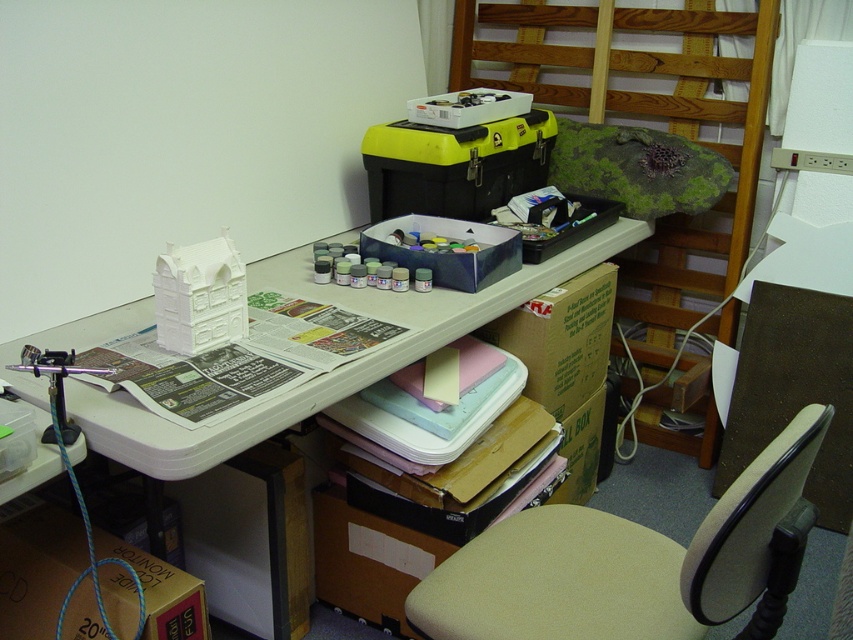
Is the position of beige fabric swivel chair at lower right less distant than that of white plastic desk at upper center?

Yes, beige fabric swivel chair at lower right is in front of white plastic desk at upper center.

Measure the distance between beige fabric swivel chair at lower right and white plastic desk at upper center.

beige fabric swivel chair at lower right is 24.31 inches away from white plastic desk at upper center.

The width and height of the screenshot is (853, 640). What do you see at coordinates (634, 563) in the screenshot? I see `beige fabric swivel chair at lower right` at bounding box center [634, 563].

This screenshot has width=853, height=640. I want to click on beige fabric swivel chair at lower right, so click(634, 563).